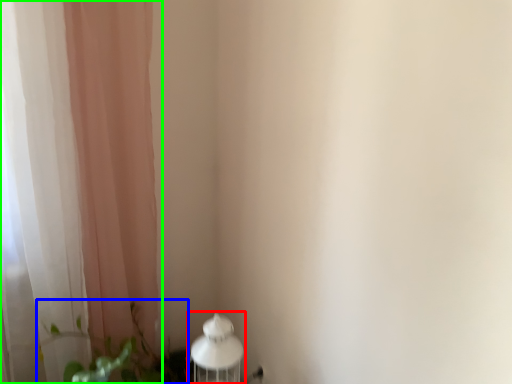
Question: Estimate the real-world distances between objects in this image. Which object is closer to table lamp (highlighted by a red box), plant (highlighted by a blue box) or curtain (highlighted by a green box)?

Choices:
 (A) plant
 (B) curtain

Answer: (A)